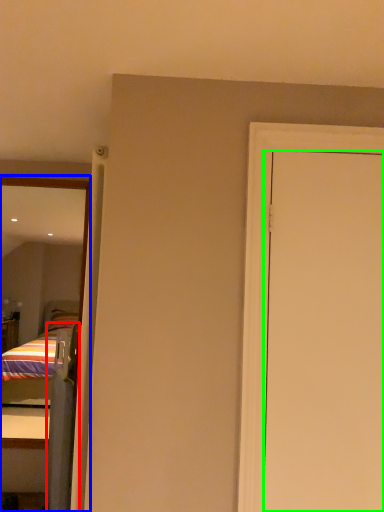
Question: Based on their relative distances, which object is farther from screen door (highlighted by a red box)? Choose from mirror (highlighted by a blue box) and door (highlighted by a green box).

Choices:
 (A) mirror
 (B) door

Answer: (B)